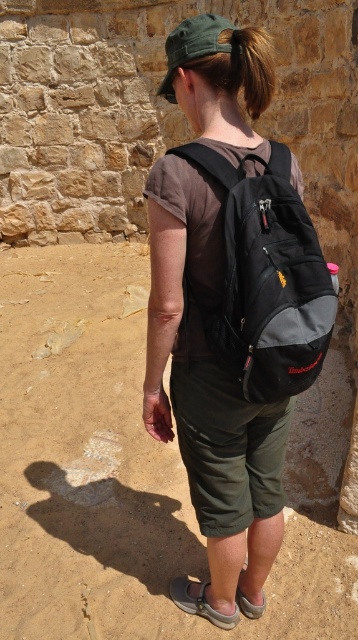
Is point (205, 522) closer to camera compared to point (326, 326)?

No, it is not.

Is matte black backpack at center positioned before black fabric backpack at back?

No, matte black backpack at center is further to the viewer.

The height and width of the screenshot is (640, 358). Describe the element at coordinates (210, 392) in the screenshot. I see `matte black backpack at center` at that location.

Find the location of a particular element. The height and width of the screenshot is (640, 358). matte black backpack at center is located at coordinates (210, 392).

Can you confirm if brown hair at upper center is positioned to the right of gray fabric sandal at lower center?

Indeed, brown hair at upper center is positioned on the right side of gray fabric sandal at lower center.

Does brown hair at upper center have a greater height compared to gray fabric sandal at lower center?

Yes, brown hair at upper center is taller than gray fabric sandal at lower center.

Is point (255, 77) positioned before point (180, 582)?

Yes, point (255, 77) is in front of point (180, 582).

Image resolution: width=358 pixels, height=640 pixels. I want to click on brown hair at upper center, so click(252, 67).

Image resolution: width=358 pixels, height=640 pixels. What are the coordinates of `black fabric backpack at back` in the screenshot? It's located at (263, 276).

Who is more forward, (316, 362) or (185, 584)?

Positioned in front is point (316, 362).

Is point (305, 376) positioned in front of point (189, 582)?

Yes, point (305, 376) is in front of point (189, 582).

At what (x,y) coordinates should I click in order to perform the action: click on black fabric backpack at back. Please return your answer as a coordinate pair (x, y). Looking at the image, I should click on (263, 276).